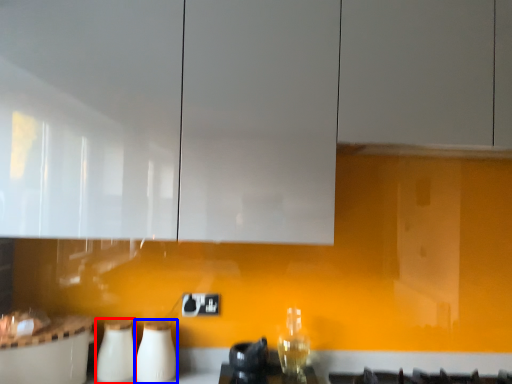
Question: Which of the following is the farthest to the observer, appliance (highlighted by a red box) or appliance (highlighted by a blue box)?

Choices:
 (A) appliance
 (B) appliance

Answer: (B)